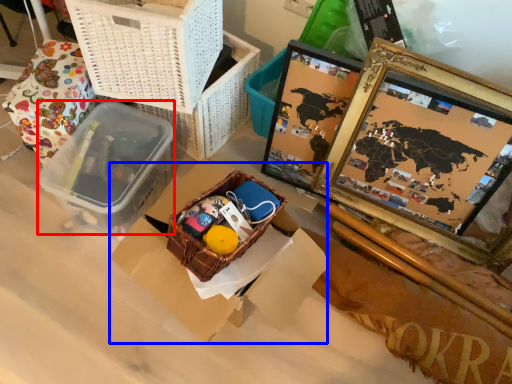
Question: Which of the following is the farthest to the observer, lunch box (highlighted by a red box) or cardboard box (highlighted by a blue box)?

Choices:
 (A) lunch box
 (B) cardboard box

Answer: (A)